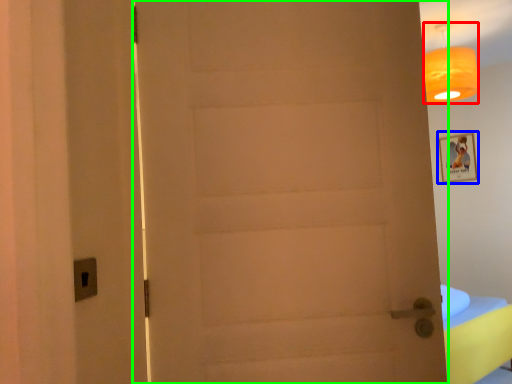
Question: Considering the real-world distances, which object is farthest from lamp (highlighted by a red box)? picture frame (highlighted by a blue box) or door (highlighted by a green box)?

Choices:
 (A) picture frame
 (B) door

Answer: (B)